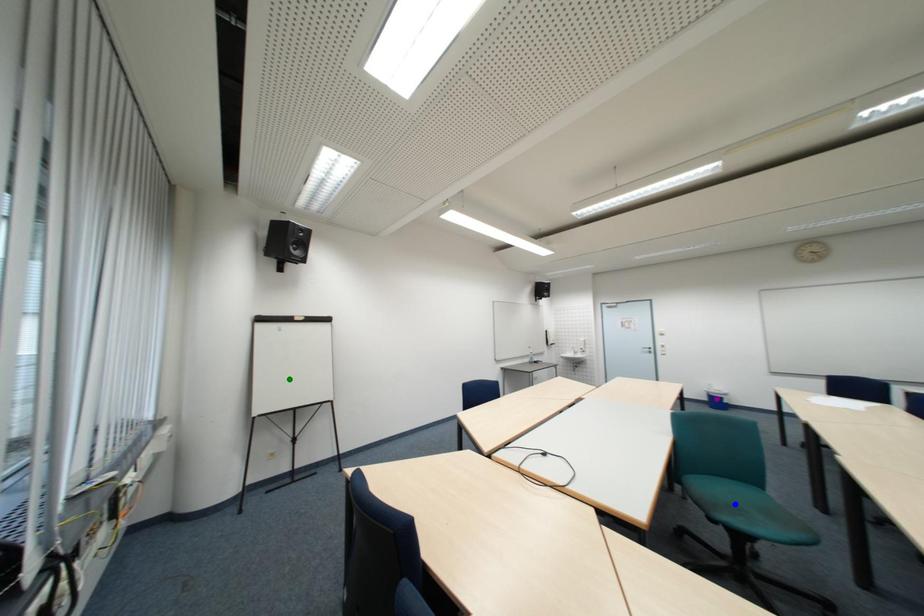
Order these from nearest to farthest:
- green point
- blue point
- purple point

blue point → green point → purple point